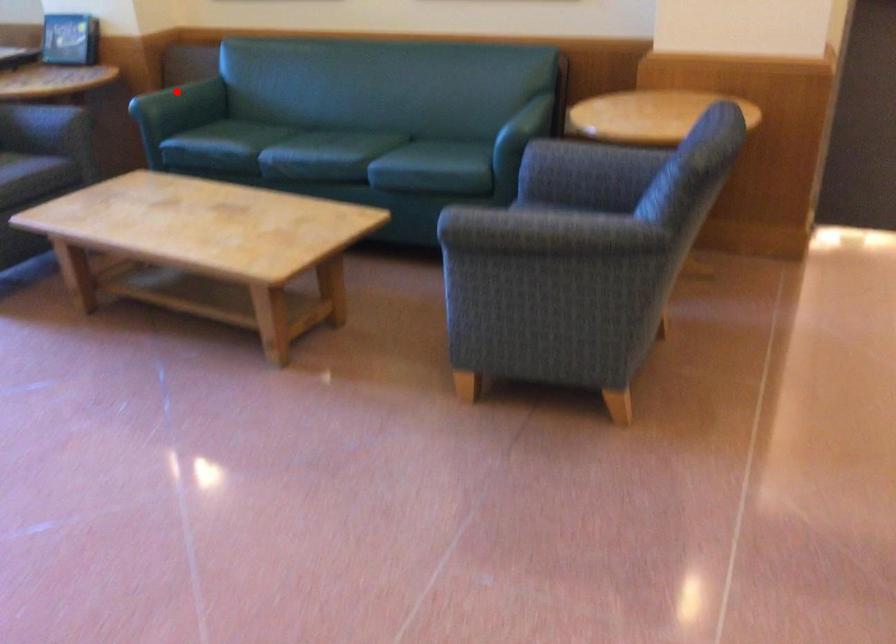
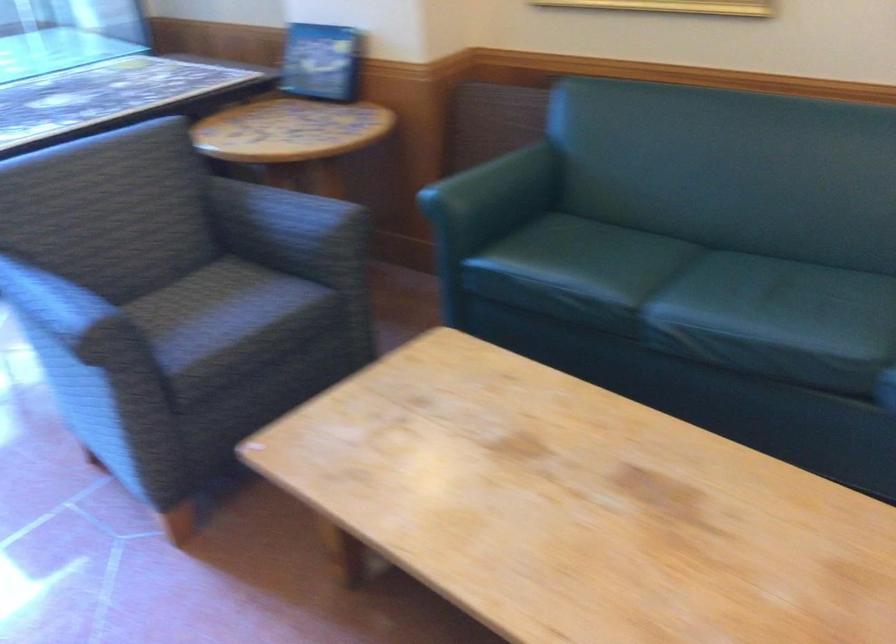
In the second image, find the point that corresponds to the highlighted location in the first image.

(496, 182)